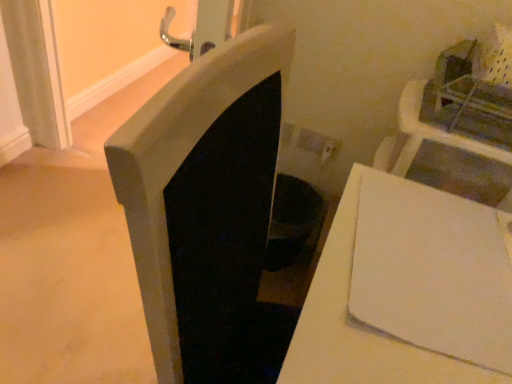
Question: Is black matte fireplace at center taller or shorter than white matte table at lower right?

Choices:
 (A) short
 (B) tall

Answer: (B)

Question: In terms of size, does black matte fireplace at center appear bigger or smaller than white matte table at lower right?

Choices:
 (A) big
 (B) small

Answer: (B)

Question: Is black matte fireplace at center spatially inside white matte table at lower right, or outside of it?

Choices:
 (A) outside
 (B) inside

Answer: (A)

Question: Is white matte table at lower right situated inside black matte fireplace at center or outside?

Choices:
 (A) inside
 (B) outside

Answer: (B)

Question: Considering the positions of white matte table at lower right and black matte fireplace at center in the image, is white matte table at lower right taller or shorter than black matte fireplace at center?

Choices:
 (A) short
 (B) tall

Answer: (A)

Question: Considering the positions of point (316, 370) and point (252, 253), is point (316, 370) closer or farther from the camera than point (252, 253)?

Choices:
 (A) farther
 (B) closer

Answer: (B)

Question: Considering the relative positions of white matte table at lower right and black matte fireplace at center in the image provided, is white matte table at lower right to the left or to the right of black matte fireplace at center?

Choices:
 (A) left
 (B) right

Answer: (B)